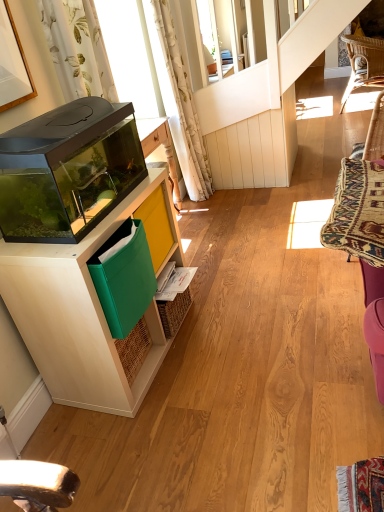
Find the location of a particular element. This screenshot has height=512, width=384. vacant space to the right of white wood cabinet at left is located at coordinates 241,350.